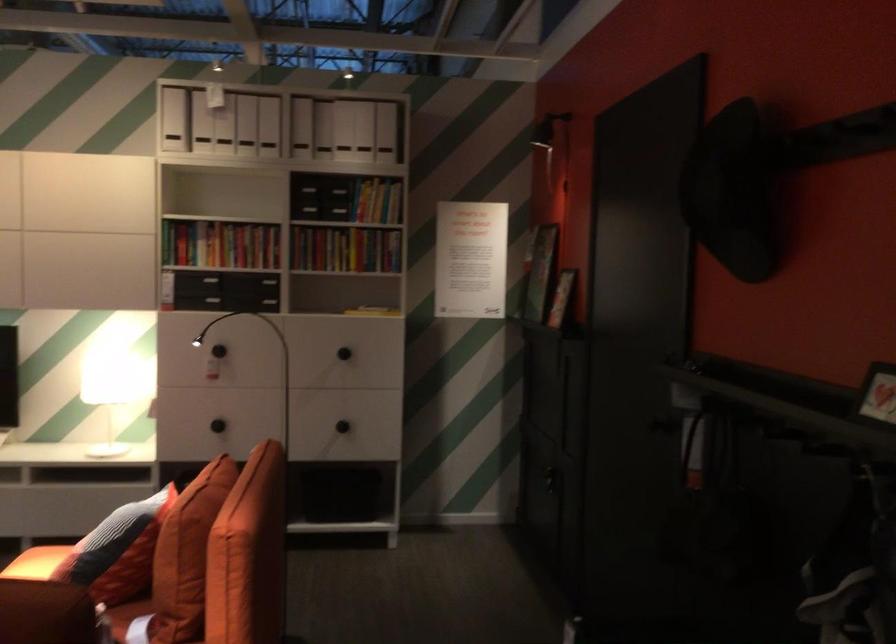
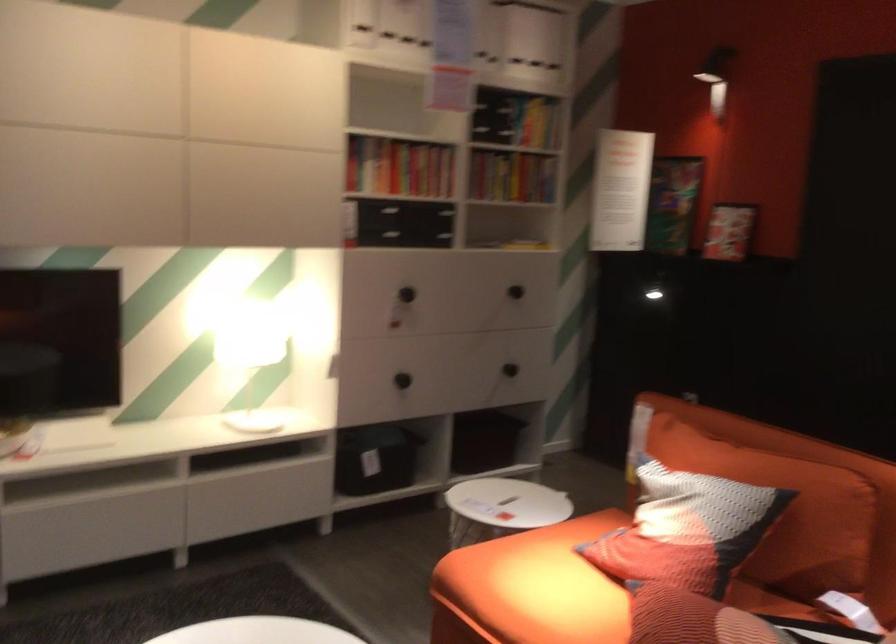
Find the pixel in the second image that matches point (99, 536) in the first image.

(785, 511)